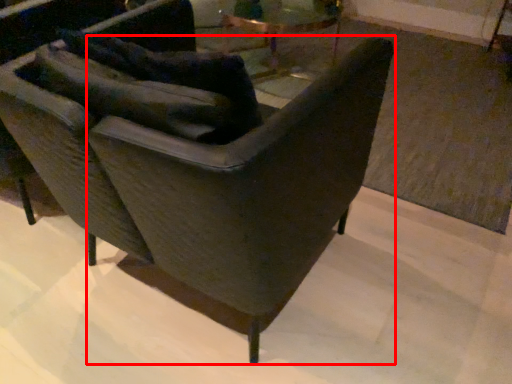
Question: From the image, what is the correct spatial relationship of rocking chair (annotated by the red box) in relation to chair?

Choices:
 (A) left
 (B) right

Answer: (B)